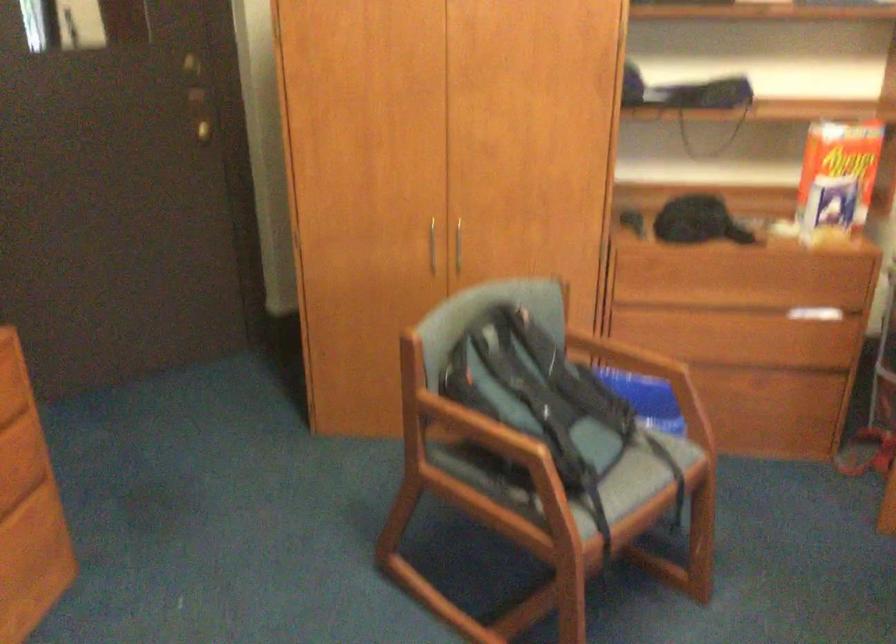
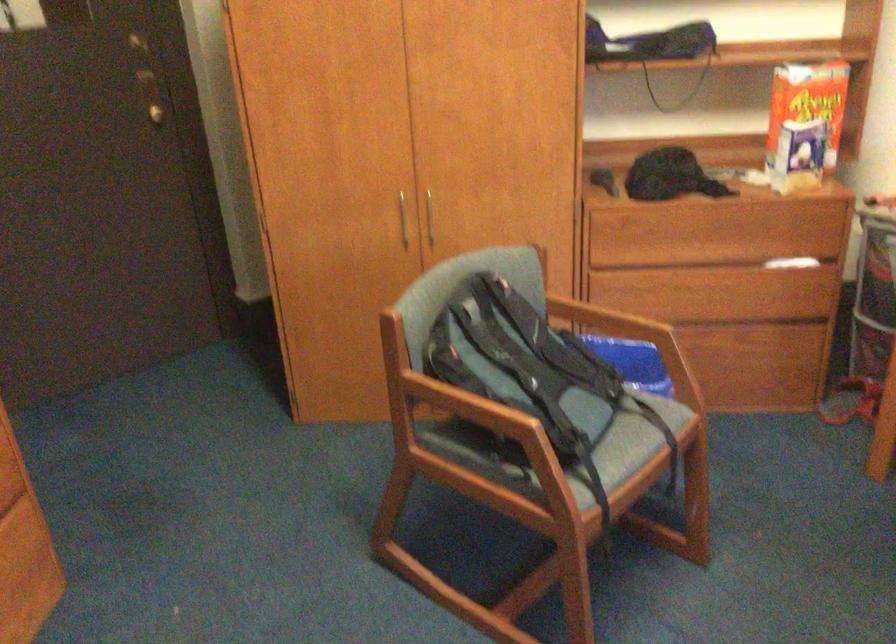
The point at (x=625, y=362) is marked in the first image. Where is the corresponding point in the second image?

(609, 325)